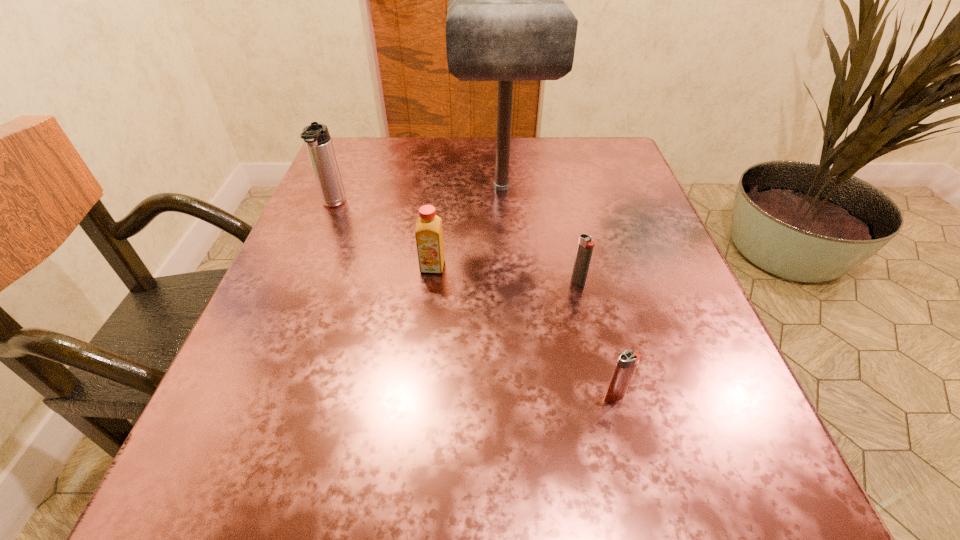
The height and width of the screenshot is (540, 960). In order to click on vacant space at the far left corner in this screenshot , I will do `click(391, 183)`.

In the image, there is a desktop. Where is `free space at the near left corner`? free space at the near left corner is located at coordinates (183, 474).

In the image, there is a desktop. Identify the location of vacant space at the far right corner. (612, 145).

Where is `free space between the second tallest object and the mallet`? The height and width of the screenshot is (540, 960). free space between the second tallest object and the mallet is located at coordinates (418, 196).

Locate an element on the screen. vacant area that lies between the thermos bottle and the fourth object from right to left is located at coordinates (383, 235).

Find the location of `free area in between the thermos bottle and the orange juice`. free area in between the thermos bottle and the orange juice is located at coordinates point(383,235).

Image resolution: width=960 pixels, height=540 pixels. I want to click on blank region between the farther igniter and the second object from left to right, so click(506, 274).

The image size is (960, 540). Find the location of `blank region between the fourth farthest object and the leftmost object`. blank region between the fourth farthest object and the leftmost object is located at coordinates (456, 243).

Image resolution: width=960 pixels, height=540 pixels. Find the location of `free spot between the tallest object and the thermos bottle`. free spot between the tallest object and the thermos bottle is located at coordinates (418, 196).

Find the location of `free space between the nearer igniter and the thermos bottle`. free space between the nearer igniter and the thermos bottle is located at coordinates (474, 300).